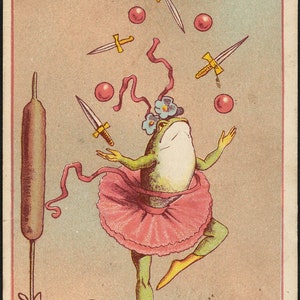
Identify the location of marble. This screenshot has height=300, width=300. (225, 102), (205, 21), (135, 13), (102, 91).